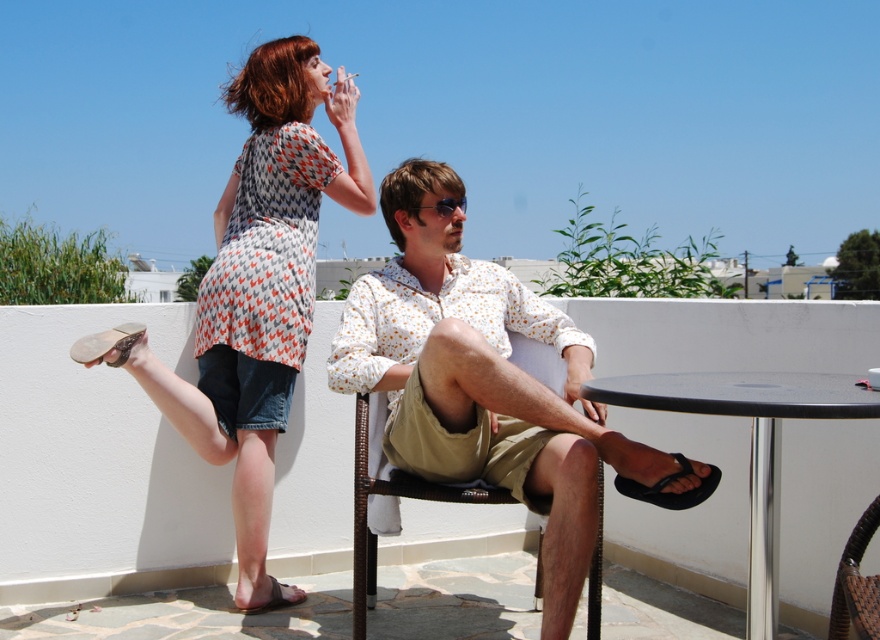
Question: Can you confirm if white printed shirt at center is positioned above printed cotton dress at upper left?

Choices:
 (A) yes
 (B) no

Answer: (B)

Question: Can you confirm if white printed shirt at center is positioned to the right of woven brown chair at lower right?

Choices:
 (A) no
 (B) yes

Answer: (A)

Question: Based on their relative distances, which object is nearer to the woven rattan chair at center?

Choices:
 (A) printed cotton dress at upper left
 (B) white printed shirt at center
 (C) black plastic table at lower right
 (D) woven brown chair at lower right

Answer: (B)

Question: Which point appears closest to the camera in this image?

Choices:
 (A) (594, 573)
 (B) (783, 380)

Answer: (B)

Question: From the image, what is the correct spatial relationship of white printed shirt at center in relation to woven brown chair at lower right?

Choices:
 (A) left
 (B) right

Answer: (A)

Question: Which point is farther from the camera taking this photo?

Choices:
 (A) (367, 412)
 (B) (352, 296)
 (C) (842, 612)

Answer: (B)